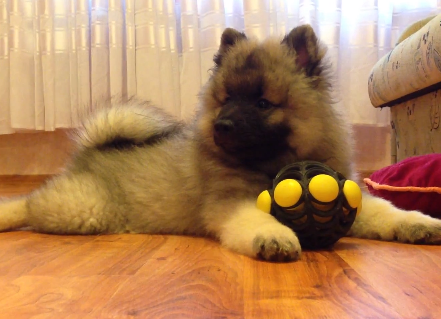
The width and height of the screenshot is (441, 319). What are the coordinates of `lace on curtain` in the screenshot? It's located at (190, 37).